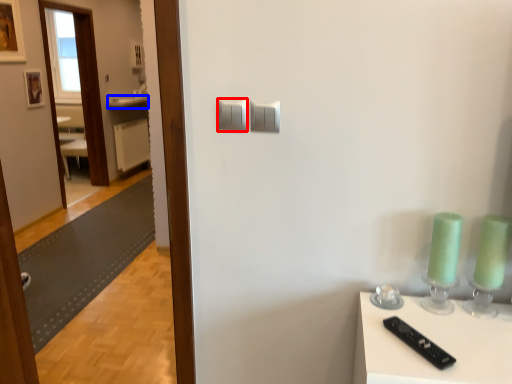
Question: Among these objects, which one is farthest to the camera, light switch (highlighted by a red box) or counter top (highlighted by a blue box)?

Choices:
 (A) light switch
 (B) counter top

Answer: (B)